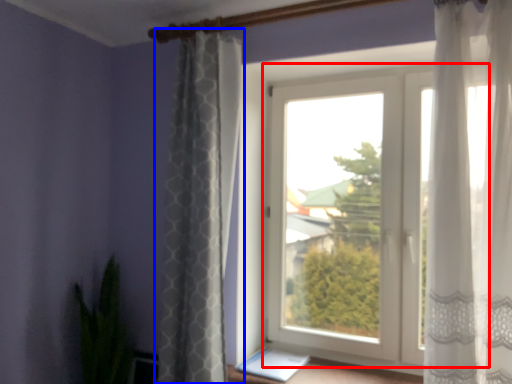
Question: Which point is closer to the camera, window (highlighted by a red box) or curtain (highlighted by a blue box)?

Choices:
 (A) window
 (B) curtain

Answer: (B)